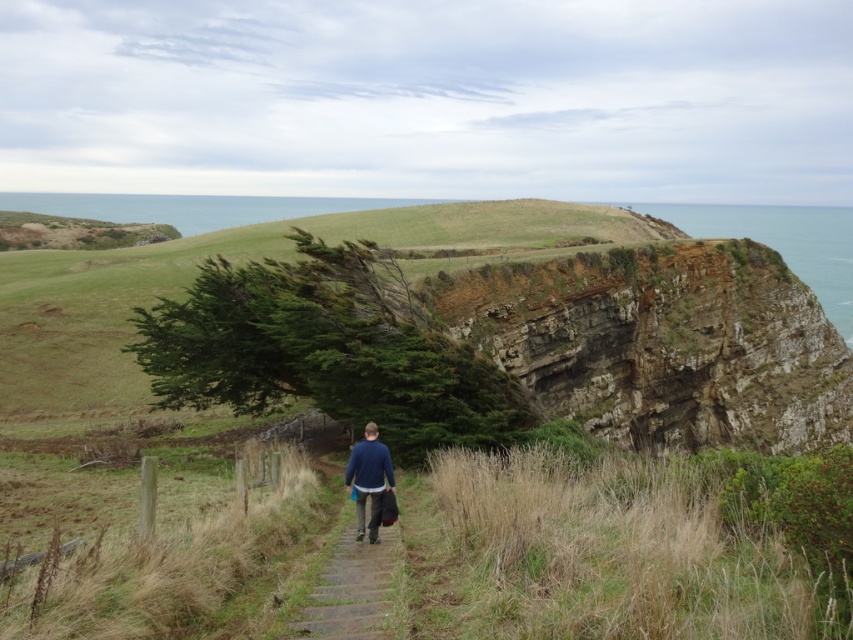
Measure the distance between dry grass at lower right and rugged stone cliff at upper right.

The distance of dry grass at lower right from rugged stone cliff at upper right is 138.45 feet.

Is dry grass at lower right positioned in front of rugged stone cliff at upper right?

That is True.

Is point (434, 636) farther from camera compared to point (585, 317)?

No.

Identify the location of dry grass at lower right. (611, 550).

Is green grassy hillside at center below brown wooden path at center?

Actually, green grassy hillside at center is above brown wooden path at center.

Is green grassy hillside at center further to camera compared to brown wooden path at center?

Yes, green grassy hillside at center is behind brown wooden path at center.

This screenshot has width=853, height=640. Describe the element at coordinates (604, 320) in the screenshot. I see `green grassy hillside at center` at that location.

Where is `green grassy hillside at center`? The image size is (853, 640). green grassy hillside at center is located at coordinates (604, 320).

Does brown wooden path at center appear over blue cotton sweater at center?

No.

Is the position of brown wooden path at center more distant than that of blue cotton sweater at center?

No, it is not.

Is point (352, 624) farther from camera compared to point (375, 490)?

No, (352, 624) is closer to viewer.

The image size is (853, 640). In order to click on brown wooden path at center in this screenshot , I will do `click(351, 589)`.